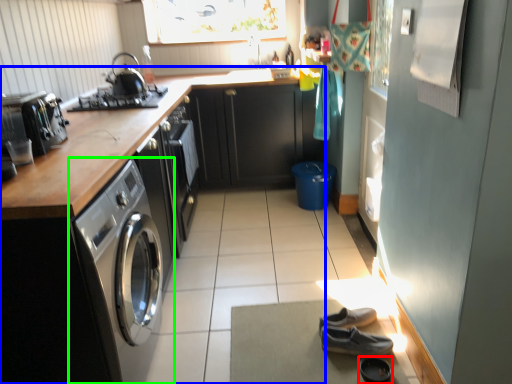
Question: Based on their relative distances, which object is farther from shoe (highlighted by a red box)? Choose from cabinetry (highlighted by a blue box) and washing machine (highlighted by a green box).

Choices:
 (A) cabinetry
 (B) washing machine

Answer: (A)